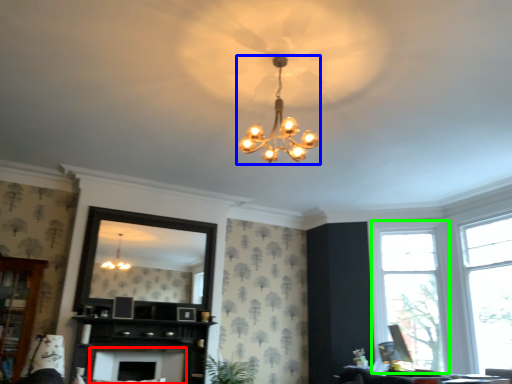
Question: Which object is the closest to the fireplace (highlighted by a red box)? Choose among these: lamp (highlighted by a blue box) or window (highlighted by a green box).

Choices:
 (A) lamp
 (B) window

Answer: (A)